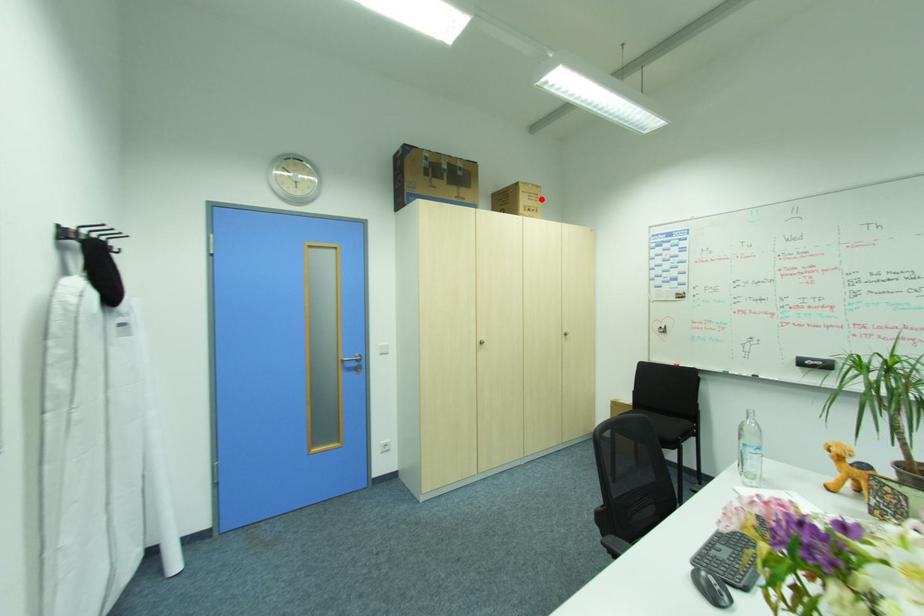
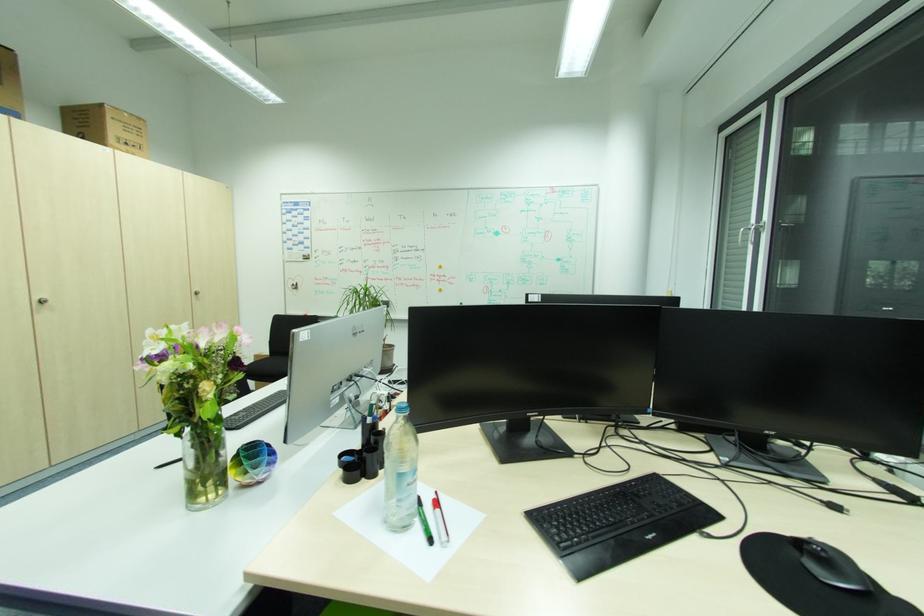
Find the pixel in the second image that matches the highlighted location in the first image.

(146, 134)